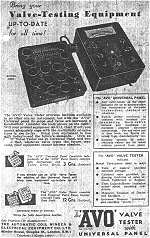
You are a GUI agent. You are given a task and a screenshot of the screen. Output one action in this format:
    pyautogui.click(x=<x>, y=<y>)
    Task: Click on the box
    The width and height of the screenshot is (150, 238).
    Given the screenshot: What is the action you would take?
    click(x=107, y=46)